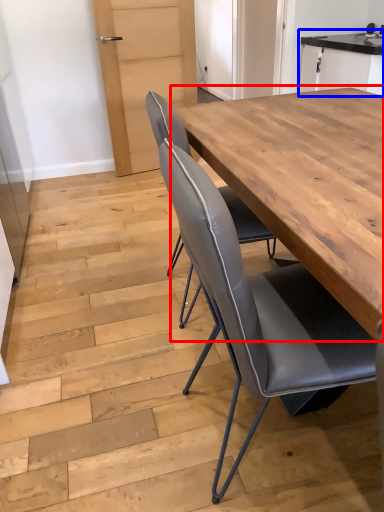
Question: Which object is closer to the camera taking this photo, table (highlighted by a red box) or cabinetry (highlighted by a blue box)?

Choices:
 (A) table
 (B) cabinetry

Answer: (A)